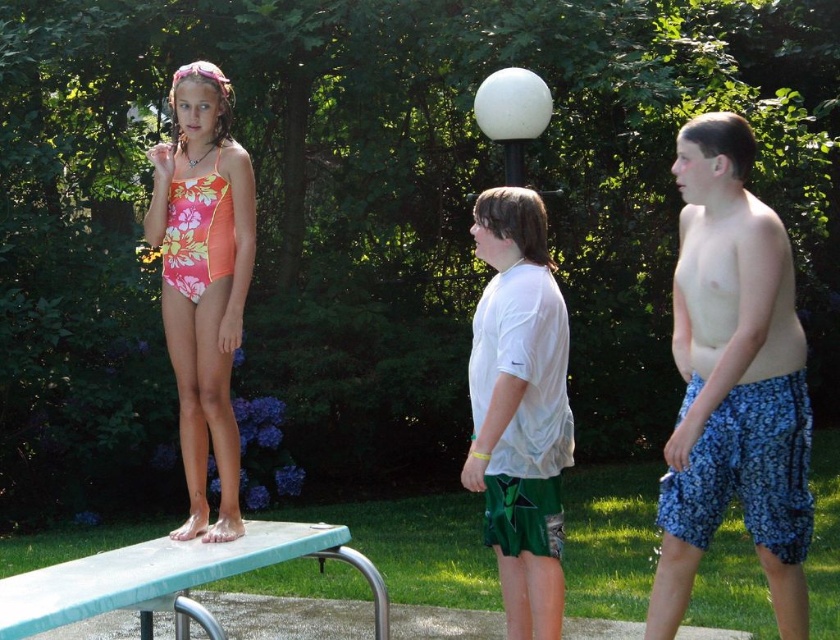
Is floral print swimsuit at center below green metallic rail at lower left?

Actually, floral print swimsuit at center is above green metallic rail at lower left.

The image size is (840, 640). Describe the element at coordinates (203, 282) in the screenshot. I see `floral print swimsuit at center` at that location.

Where is `floral print swimsuit at center`? Image resolution: width=840 pixels, height=640 pixels. floral print swimsuit at center is located at coordinates (203, 282).

From the picture: Does blue floral shorts at right come behind green metallic rail at lower left?

Yes, blue floral shorts at right is further from the viewer.

Can you confirm if blue floral shorts at right is shorter than green metallic rail at lower left?

In fact, blue floral shorts at right may be taller than green metallic rail at lower left.

Image resolution: width=840 pixels, height=640 pixels. Identify the location of blue floral shorts at right. (733, 381).

The width and height of the screenshot is (840, 640). What are the coordinates of `white matte shirt at center` in the screenshot? It's located at (518, 408).

Can you confirm if white matte shirt at center is positioned to the right of floral print swimsuit at center?

Yes, white matte shirt at center is to the right of floral print swimsuit at center.

Where is `white matte shirt at center`? This screenshot has width=840, height=640. white matte shirt at center is located at coordinates (518, 408).